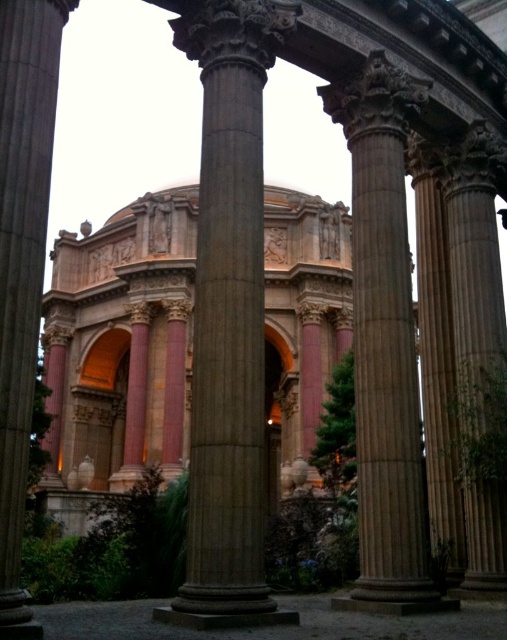
Where is `marble column at center`? The height and width of the screenshot is (640, 507). marble column at center is located at coordinates pyautogui.click(x=383, y=342).

Is marble column at center below pink stone column at left?

No.

Does point (379, 532) come in front of point (6, 168)?

No.

Locate an element on the screen. marble column at center is located at coordinates (383, 342).

Is point (226, 612) positioned in front of point (25, 241)?

That is False.

Who is positioned more to the right, brown stone column at center or pink stone column at left?

Positioned to the right is brown stone column at center.

This screenshot has width=507, height=640. What do you see at coordinates (229, 317) in the screenshot?
I see `brown stone column at center` at bounding box center [229, 317].

Identify the location of brown stone column at center. (229, 317).

Can you confirm if brown stone column at center is positioned above marble column at center?

Actually, brown stone column at center is below marble column at center.

Which is in front, point (260, 528) or point (380, 481)?

Positioned in front is point (260, 528).

You are a GUI agent. You are given a task and a screenshot of the screen. Output one action in this format:
    pyautogui.click(x=<x>, y=<y>)
    Task: Click on the brown stone column at center
    The image size is (507, 640).
    Given the screenshot: What is the action you would take?
    pyautogui.click(x=229, y=317)